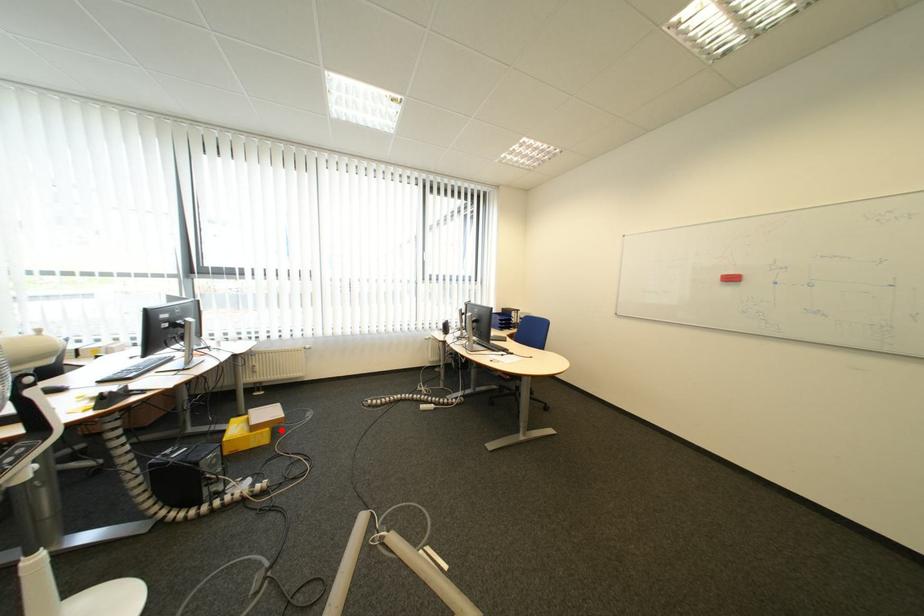
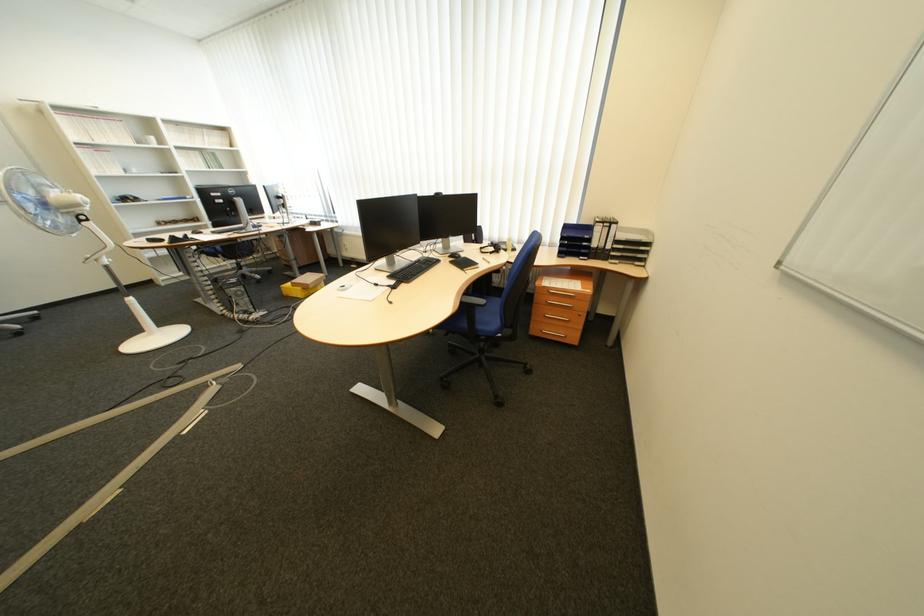
Question: I am providing you with two images of the same scene from different viewpoints. In image1, a red point is highlighted. Considering the same 3D point in image2, which of the following is correct?

Choices:
 (A) It is closer
 (B) It is farther

Answer: (B)